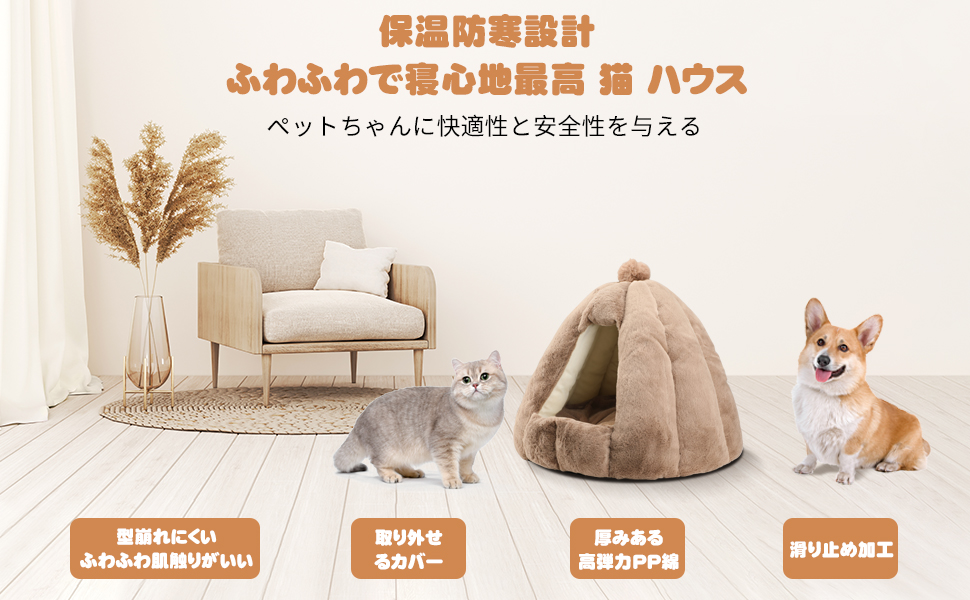
Where is `chair`? The image size is (970, 600). chair is located at coordinates (259, 264).